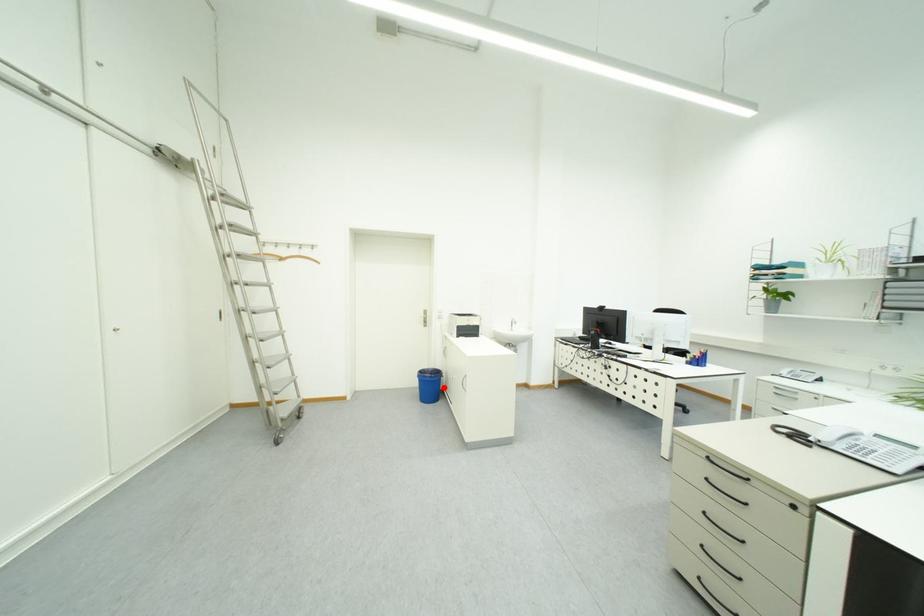
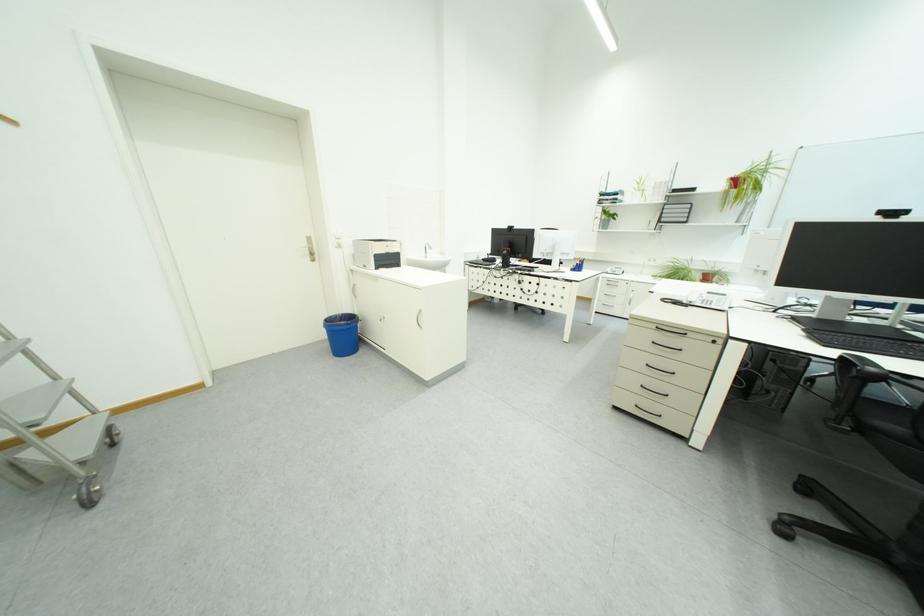
Question: I am providing you with two images of the same scene from different viewpoints. A red point is marked on the first image. Can you still see the location of the red point in image 2?

Choices:
 (A) Yes
 (B) No

Answer: (A)